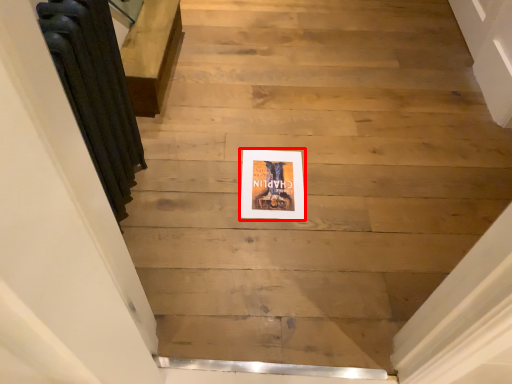
Question: From the image's perspective, what is the correct spatial positioning of picture frame (annotated by the red box) in reference to radiator?

Choices:
 (A) below
 (B) above

Answer: (A)